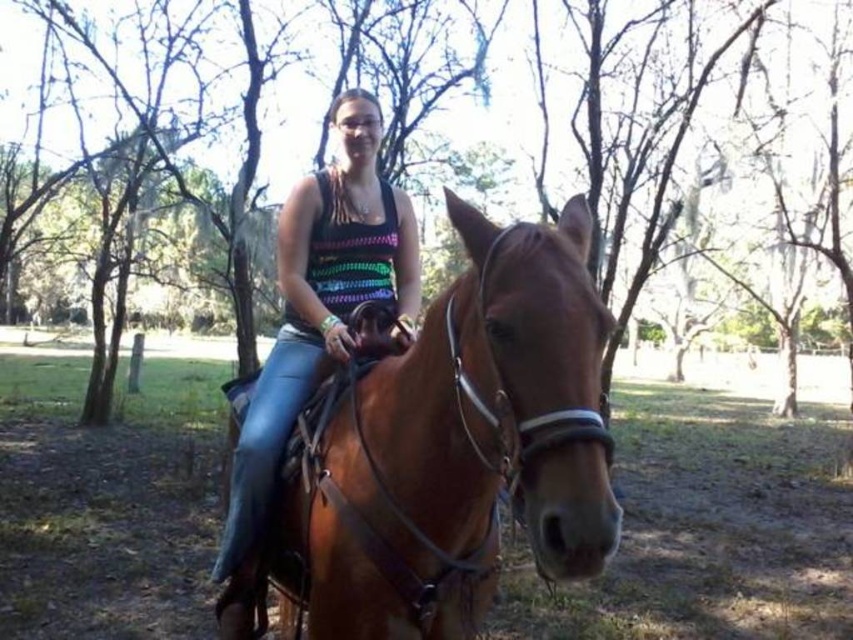
You are planning to take a photo of the brown wood tree at center and the brown leather horse at center from a distance. Which object will appear wider in the photo?

The brown wood tree at center will appear wider in the photo because its width surpasses that of the brown leather horse at center.

Based on the photo, you are a photographer planning to take a photo of the brown wood tree at center and the brown leather horse at center. Since you want both subjects to appear clearly in the frame, which one should you focus on first to ensure proper depth of field?

The brown wood tree at center is larger in size than the brown leather horse at center, so you should focus on the brown wood tree at center first to ensure both are in focus.